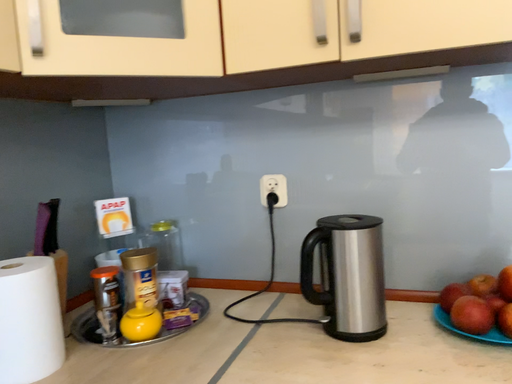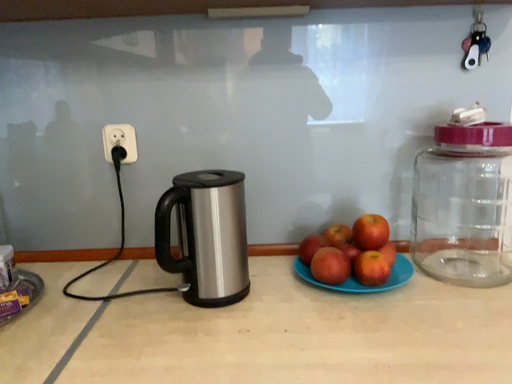
Question: How did the camera likely rotate when shooting the video?

Choices:
 (A) rotated right
 (B) rotated left

Answer: (A)